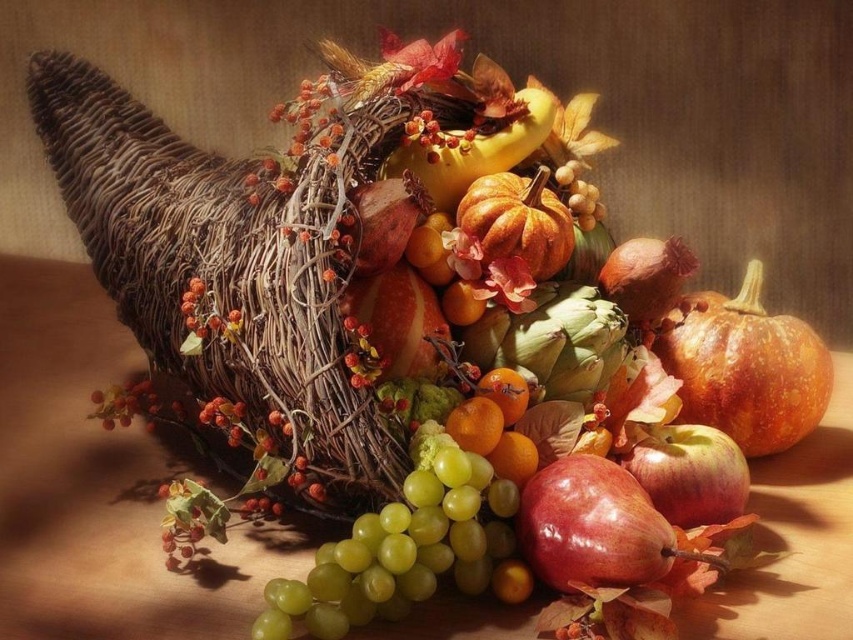
You are setting up a fruit display and need to know the spatial relationship between the green matte grapes at center and the glossy red apple at center. Which one is wider?

The green matte grapes at center are wider than the glossy red apple at center.

Based on the coordinates provided, where is the glossy red apple at center located in the image?

The glossy red apple at center is located at the coordinates point (689, 474).